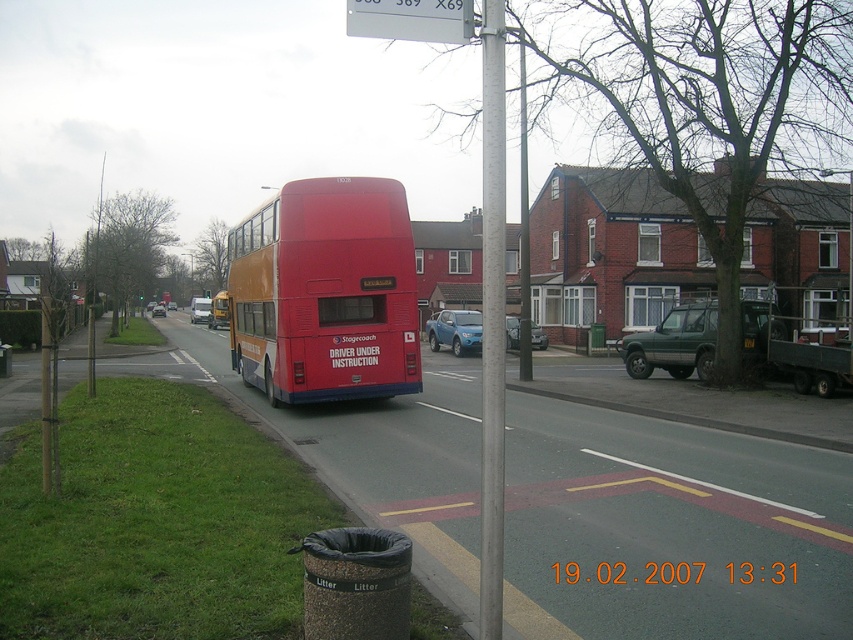
Is matte red bus at center positioned at the back of metallic pole at center?

Yes, it is.

Which is below, matte red bus at center or metallic pole at center?

matte red bus at center is below.

The width and height of the screenshot is (853, 640). I want to click on matte red bus at center, so (325, 292).

Who is positioned more to the right, metallic pole at center or white plastic sign at upper center?

metallic pole at center

Is metallic pole at center bigger than white plastic sign at upper center?

Indeed, metallic pole at center has a larger size compared to white plastic sign at upper center.

Does point (488, 74) come farther from viewer compared to point (454, 17)?

That is True.

You are a GUI agent. You are given a task and a screenshot of the screen. Output one action in this format:
    pyautogui.click(x=<x>, y=<y>)
    Task: Click on the metallic pole at center
    
    Given the screenshot: What is the action you would take?
    pyautogui.click(x=492, y=320)

Measure the distance between metallic pole at center and camera.

The distance of metallic pole at center from camera is 3.28 meters.

Is metallic pole at center thinner than red matte bus at center?

Yes, metallic pole at center is thinner than red matte bus at center.

Is point (500, 278) more distant than point (218, 292)?

No, (500, 278) is closer to viewer.

The height and width of the screenshot is (640, 853). What are the coordinates of `metallic pole at center` in the screenshot? It's located at (492, 320).